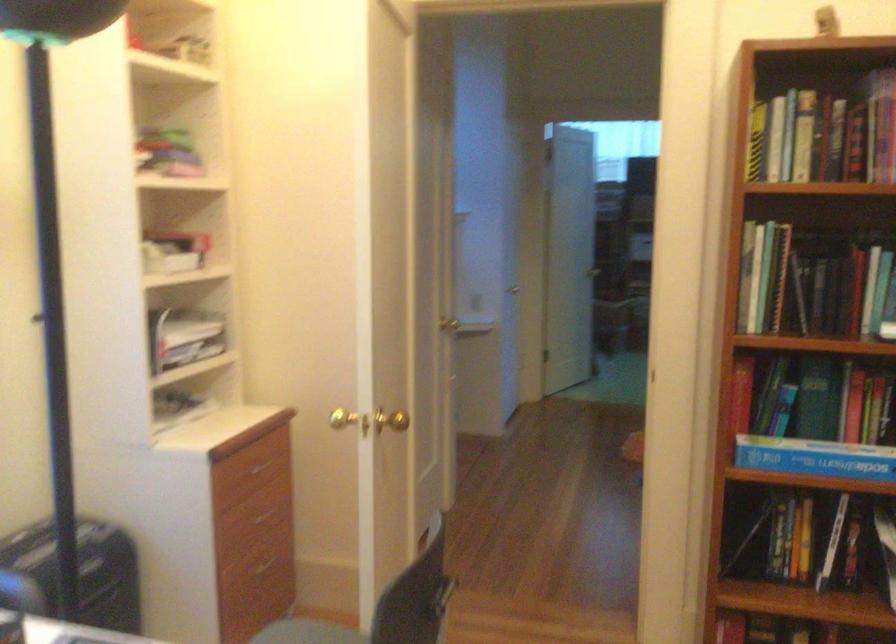
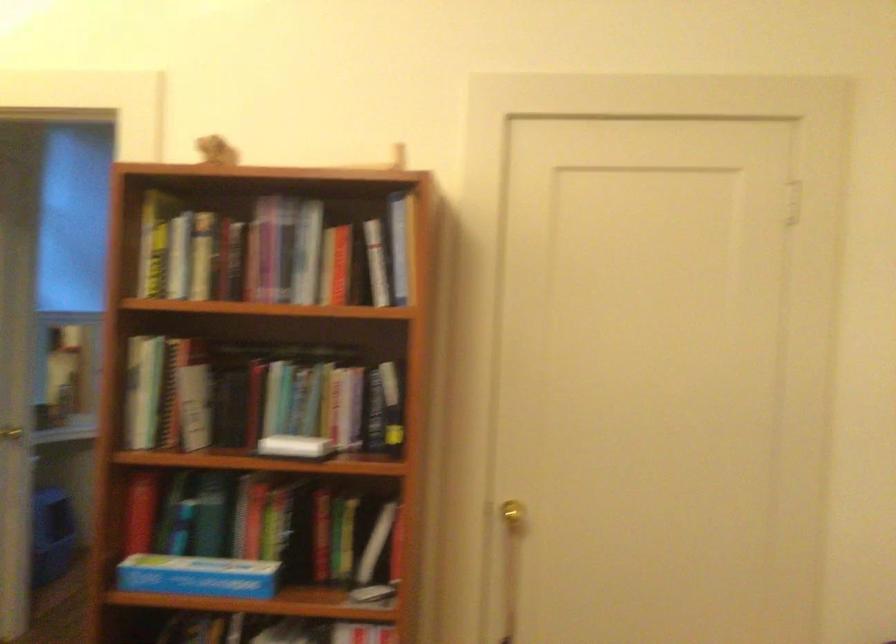
Where in the second image is the point corresponding to pixel 814 397 from the first image?

(208, 514)